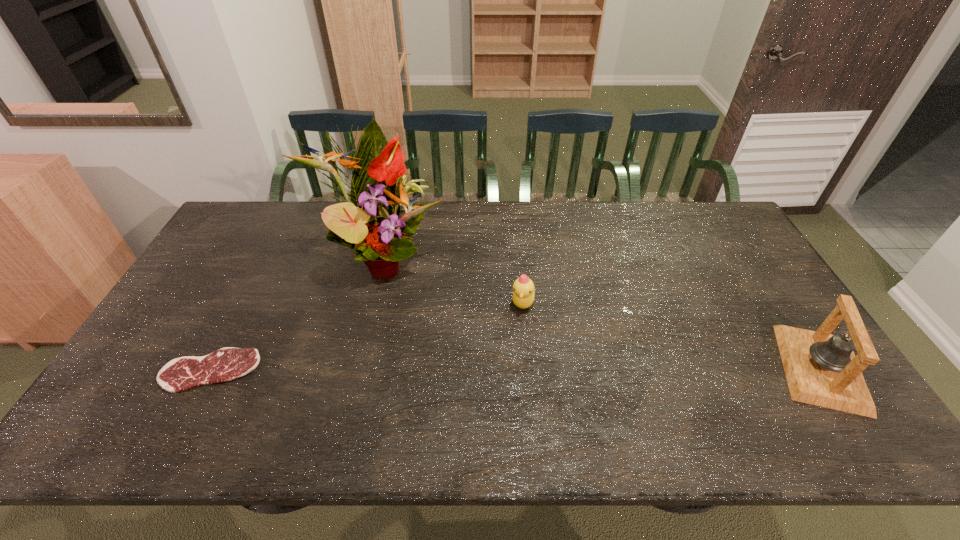
The height and width of the screenshot is (540, 960). What are the coordinates of `object at the right edge` in the screenshot? It's located at (821, 369).

Find the location of `object present at the near left corner`. object present at the near left corner is located at coordinates (180, 374).

This screenshot has width=960, height=540. Find the location of `object located at the near right corner`. object located at the near right corner is located at coordinates (821, 369).

This screenshot has width=960, height=540. What are the coordinates of `free space at the far edge of the desktop` in the screenshot? It's located at (297, 225).

Locate an element on the screen. Image resolution: width=960 pixels, height=540 pixels. vacant region at the near edge of the desktop is located at coordinates (529, 399).

The width and height of the screenshot is (960, 540). I want to click on vacant region at the right edge of the desktop, so click(x=777, y=363).

Identify the location of vacant space at the far left corner of the desktop. Image resolution: width=960 pixels, height=540 pixels. (220, 241).

Identify the location of free space at the far right corner. (708, 235).

The width and height of the screenshot is (960, 540). In order to click on free space between the steak and the bell in this screenshot , I will do `click(516, 369)`.

Find the location of a particular element. The width and height of the screenshot is (960, 540). empty space between the rightmost object and the second object from right to left is located at coordinates (672, 335).